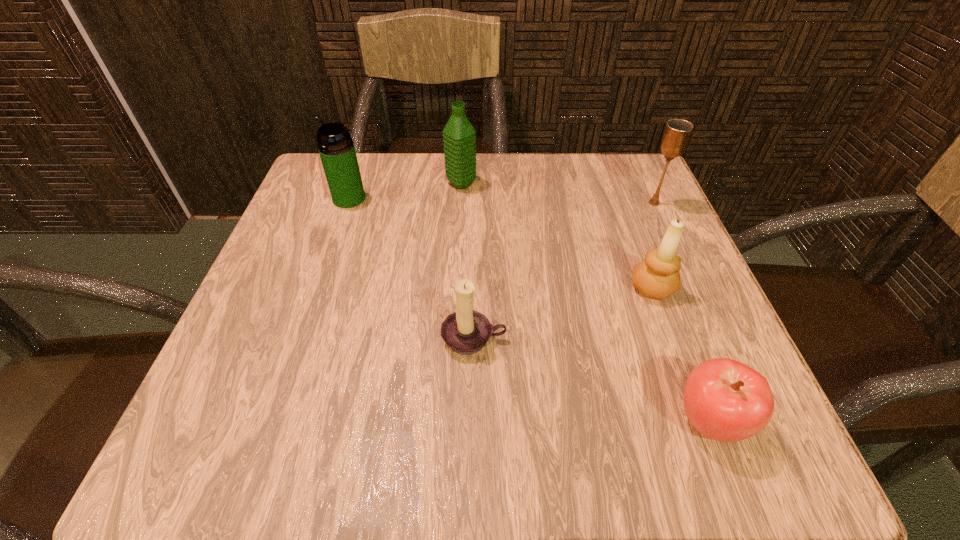
Identify which object is the nearest to the thermos bottle. Please provide its 2D coordinates. Your answer should be formatted as a tuple, i.e. [(x, y)], where the tuple contains the x and y coordinates of a point satisfying the conditions above.

[(459, 135)]

At what (x,y) coordinates should I click in order to perform the action: click on object that is the nearest to the water bottle. Please return your answer as a coordinate pair (x, y). Image resolution: width=960 pixels, height=540 pixels. Looking at the image, I should click on (336, 148).

Where is `blank space that satisfies the following two spatial constraints: 1. from the spout of the thermos bottle; 2. on the back side of the apple`? The width and height of the screenshot is (960, 540). blank space that satisfies the following two spatial constraints: 1. from the spout of the thermos bottle; 2. on the back side of the apple is located at coordinates (272, 421).

The width and height of the screenshot is (960, 540). I want to click on vacant space that satisfies the following two spatial constraints: 1. on the back side of the fourth farthest object; 2. from the spout of the leftmost object, so click(619, 199).

This screenshot has width=960, height=540. I want to click on vacant position in the image that satisfies the following two spatial constraints: 1. from the spout of the thermos bottle; 2. on the right side of the apple, so click(x=272, y=421).

Identify the location of vacant space that satisfies the following two spatial constraints: 1. from the spout of the leftmost object; 2. on the right side of the chalice. (348, 203).